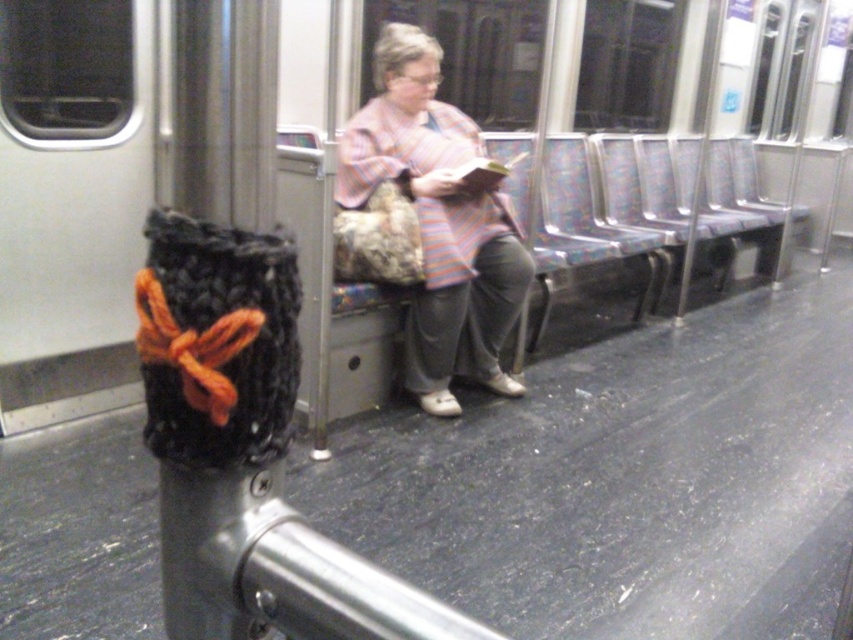
You are standing at point (418, 314) in the subway car. You need to walk to point (733, 180). Which direction should you move relative to the train car?

You should move towards the back of the subway car because point (733, 180) is behind point (418, 314).

You are a passenger on the subway and want to pick up both the black knitted bag at center and the striped fabric jacket at center. Which item should you reach for first to grab the one closer to you?

The black knitted bag at center is closer to the viewer than the striped fabric jacket at center, so you should reach for the black knitted bag at center first.

You are standing at the front of the subway car and see the black knitted bag at center. If you want to pick it up, how many steps do you need to take forward?

The black knitted bag at center is 7.55 feet away from viewer. Assuming an average step length of about 2.5 feet, you would need to take approximately 3 steps forward to reach it.